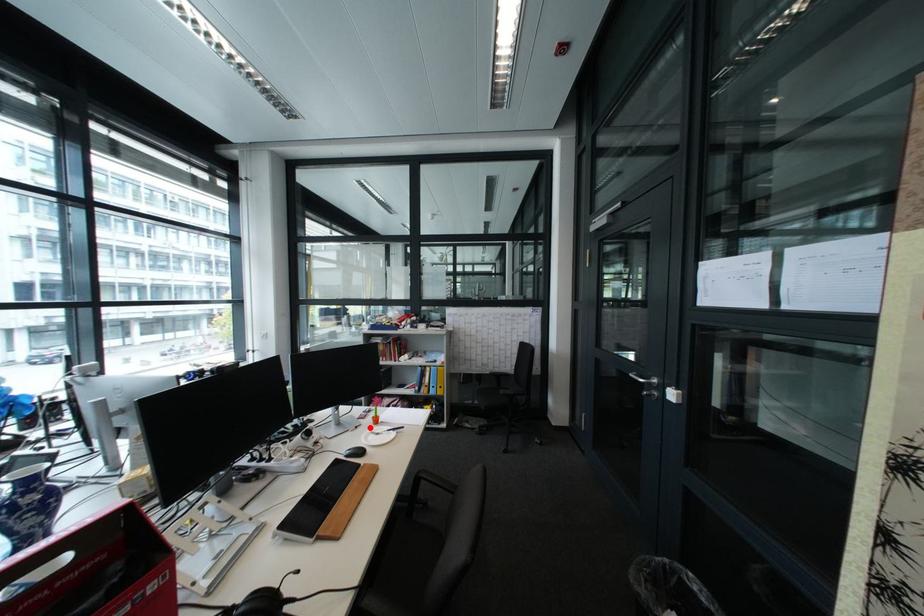
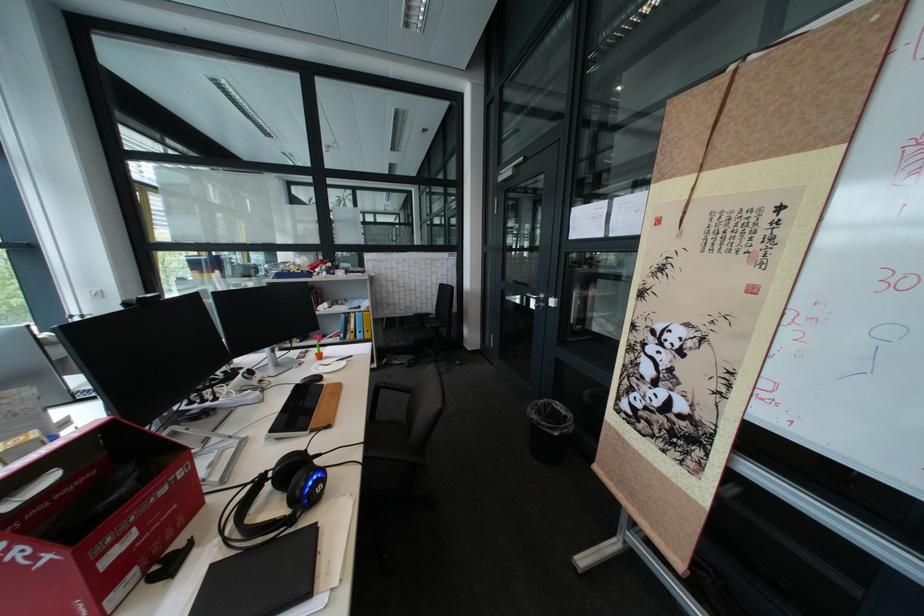
In the second image, find the point that corresponds to the highlighted location in the first image.

(313, 365)